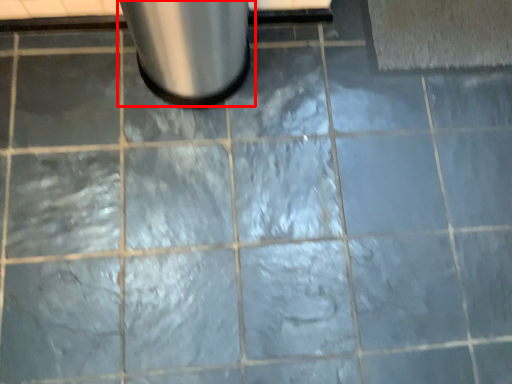
Question: In this image, where is waste container (annotated by the red box) located relative to bath mat?

Choices:
 (A) right
 (B) left

Answer: (B)